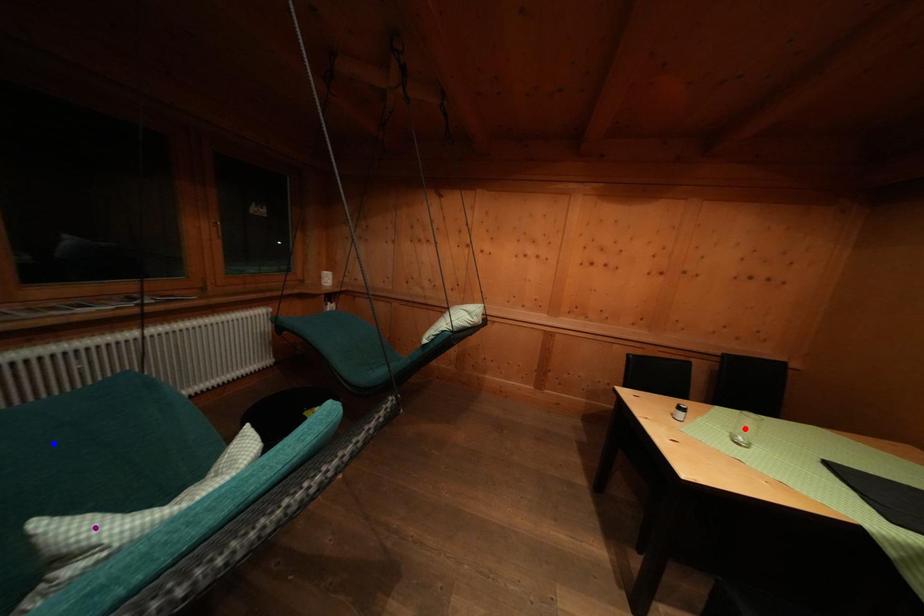
Order these from nearest to farthest:
1. purple point
2. blue point
3. red point

purple point
blue point
red point